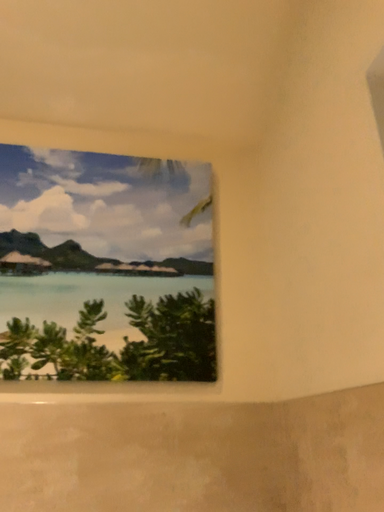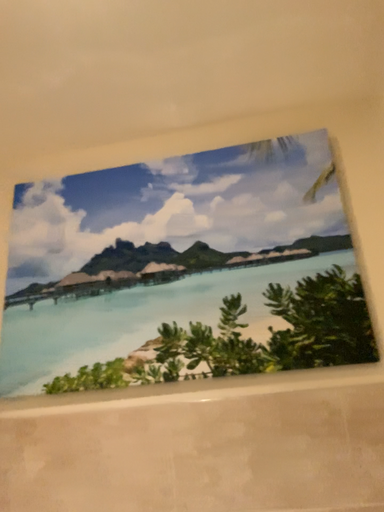
Question: How did the camera likely rotate when shooting the video?

Choices:
 (A) rotated right
 (B) rotated left

Answer: (B)